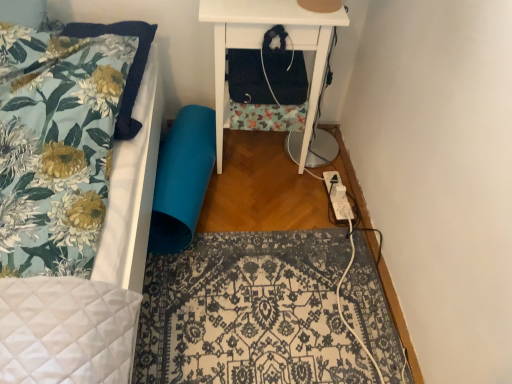
Question: Is floral fabric pillow at upper left oriented away from patterned fabric rug at center?

Choices:
 (A) yes
 (B) no

Answer: (B)

Question: From the image's perspective, is floral fabric pillow at upper left over patterned fabric rug at center?

Choices:
 (A) yes
 (B) no

Answer: (A)

Question: Does floral fabric pillow at upper left have a greater width compared to patterned fabric rug at center?

Choices:
 (A) yes
 (B) no

Answer: (B)

Question: Is floral fabric pillow at upper left facing towards patterned fabric rug at center?

Choices:
 (A) no
 (B) yes

Answer: (A)

Question: Does floral fabric pillow at upper left have a greater height compared to patterned fabric rug at center?

Choices:
 (A) no
 (B) yes

Answer: (B)

Question: From a real-world perspective, is patterned fabric rug at center physically located above or below white matte nightstand at upper right?

Choices:
 (A) above
 (B) below

Answer: (B)

Question: From the image's perspective, relative to white matte nightstand at upper right, is patterned fabric rug at center above or below?

Choices:
 (A) above
 (B) below

Answer: (B)

Question: In the image, is patterned fabric rug at center positioned in front of or behind white matte nightstand at upper right?

Choices:
 (A) behind
 (B) front

Answer: (B)

Question: Considering the positions of point (290, 236) and point (347, 18), is point (290, 236) closer or farther from the camera than point (347, 18)?

Choices:
 (A) closer
 (B) farther

Answer: (B)

Question: In terms of size, does white plastic extension cord at lower right appear bigger or smaller than floral fabric pillow at upper left?

Choices:
 (A) small
 (B) big

Answer: (A)

Question: From the image's perspective, is white plastic extension cord at lower right located above or below floral fabric pillow at upper left?

Choices:
 (A) below
 (B) above

Answer: (A)

Question: Is point (339, 220) positioned closer to the camera than point (126, 23)?

Choices:
 (A) farther
 (B) closer

Answer: (A)

Question: From their relative heights in the image, would you say white plastic extension cord at lower right is taller or shorter than floral fabric pillow at upper left?

Choices:
 (A) short
 (B) tall

Answer: (A)

Question: From a real-world perspective, is patterned fabric rug at center physically located above or below white plastic extension cord at lower right?

Choices:
 (A) above
 (B) below

Answer: (B)

Question: From the image's perspective, is patterned fabric rug at center located above or below white plastic extension cord at lower right?

Choices:
 (A) below
 (B) above

Answer: (A)